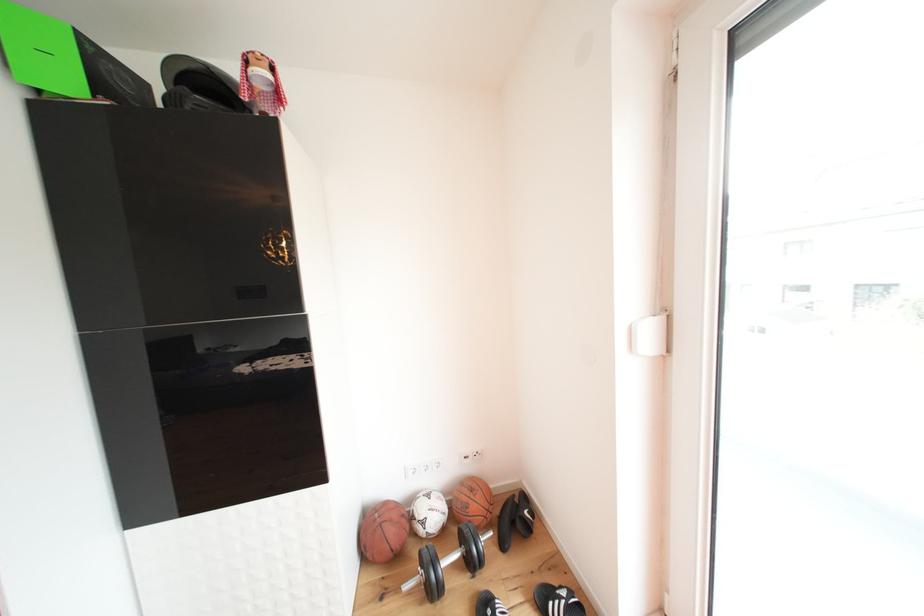
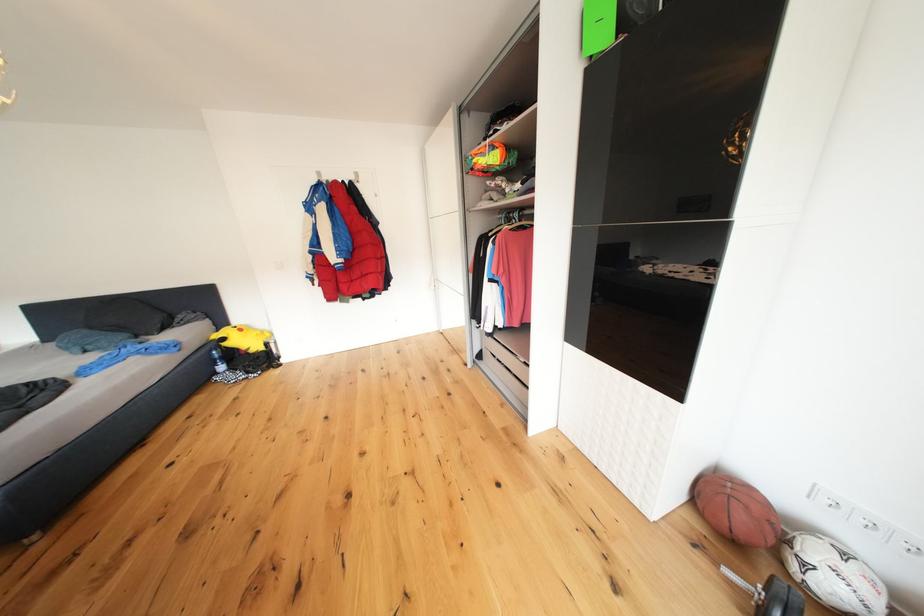
Based on the continuous images, in which direction is the camera rotating?

The camera's rotation is toward left-down.